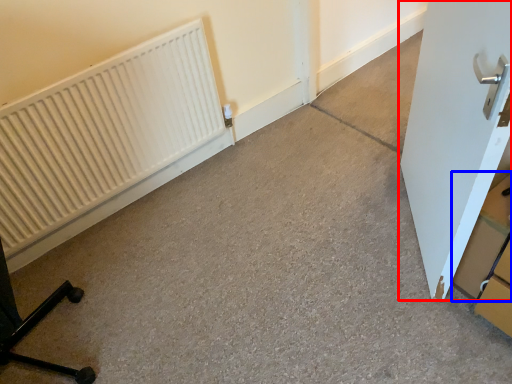
Question: Which object is closer to the camera taking this photo, door (highlighted by a red box) or cardboard box (highlighted by a blue box)?

Choices:
 (A) door
 (B) cardboard box

Answer: (A)